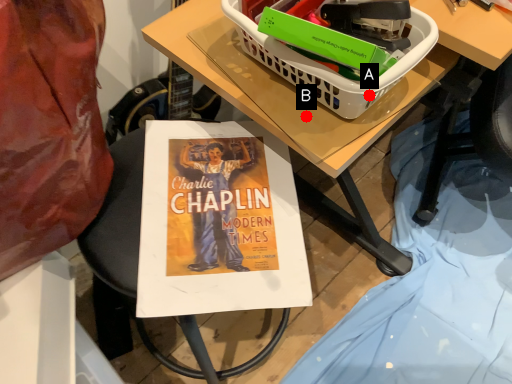
Question: Two points are circled on the image, labeled by A and B beside each circle. Which point is closer to the camera?

Choices:
 (A) A is closer
 (B) B is closer

Answer: (A)